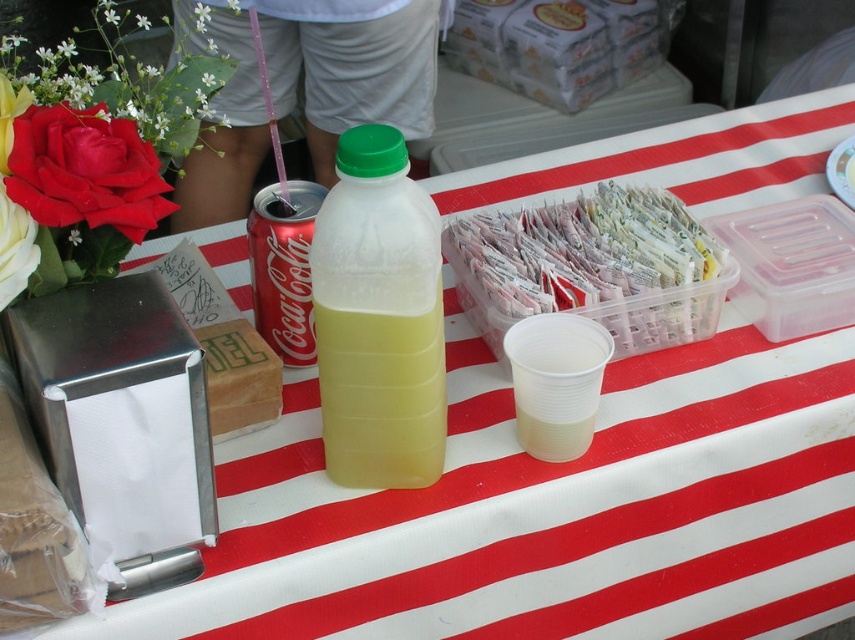
Question: Estimate the real-world distances between objects in this image. Which object is closer to the clear plastic container at center?

Choices:
 (A) white matte flower at upper left
 (B) silky red rose at upper left
 (C) matte aluminum can at left
 (D) white matte rose at left

Answer: (C)

Question: Where is clear plastic container at center located in relation to matte aluminum can at left in the image?

Choices:
 (A) below
 (B) above

Answer: (B)

Question: Is white matte rose at left below white matte flower at upper left?

Choices:
 (A) yes
 (B) no

Answer: (A)

Question: Considering the relative positions of matte silver napkin dispenser at left and matte aluminum can at left in the image provided, where is matte silver napkin dispenser at left located with respect to matte aluminum can at left?

Choices:
 (A) right
 (B) left

Answer: (B)

Question: Which point is closer to the camera?

Choices:
 (A) coord(337,358)
 (B) coord(87,132)
 (C) coord(7,244)
 (D) coord(658,252)

Answer: (C)

Question: Which point is closer to the camera?

Choices:
 (A) matte silver napkin dispenser at left
 (B) white matte rose at left
 (C) silky red rose at upper left

Answer: (C)